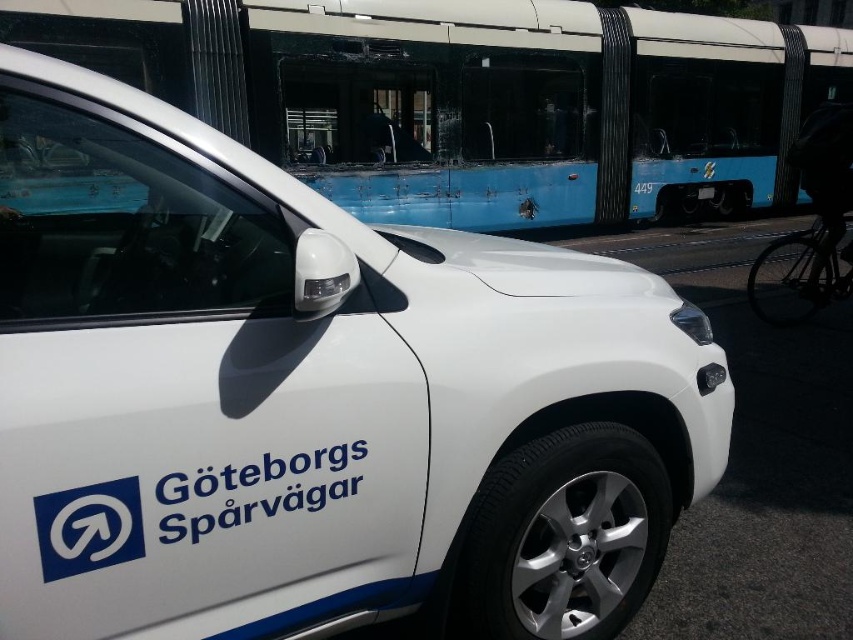
Does point (811, 294) lie behind point (703, 186)?

No, it is in front of (703, 186).

You are a GUI agent. You are given a task and a screenshot of the screen. Output one action in this format:
    pyautogui.click(x=<x>, y=<y>)
    Task: Click on the shiny black bicycle at right
    
    Given the screenshot: What is the action you would take?
    pyautogui.click(x=798, y=276)

Find the location of a particular element. The image size is (853, 640). shiny black bicycle at right is located at coordinates (798, 276).

Does blue matte bus at upper center come in front of shiny black bicycle at right?

That is False.

Which is in front, point (790, 44) or point (813, 252)?

Point (813, 252) is more forward.

Find the location of a particular element. blue matte bus at upper center is located at coordinates (474, 99).

Does point (662, 38) come behind point (711, 198)?

No, it is not.

You are a GUI agent. You are given a task and a screenshot of the screen. Output one action in this format:
    pyautogui.click(x=<x>, y=<y>)
    Task: Click on the blue matte bus at upper center
    
    Given the screenshot: What is the action you would take?
    pyautogui.click(x=474, y=99)

Locate an element on the screen. This screenshot has height=640, width=853. blue matte bus at upper center is located at coordinates [x=474, y=99].